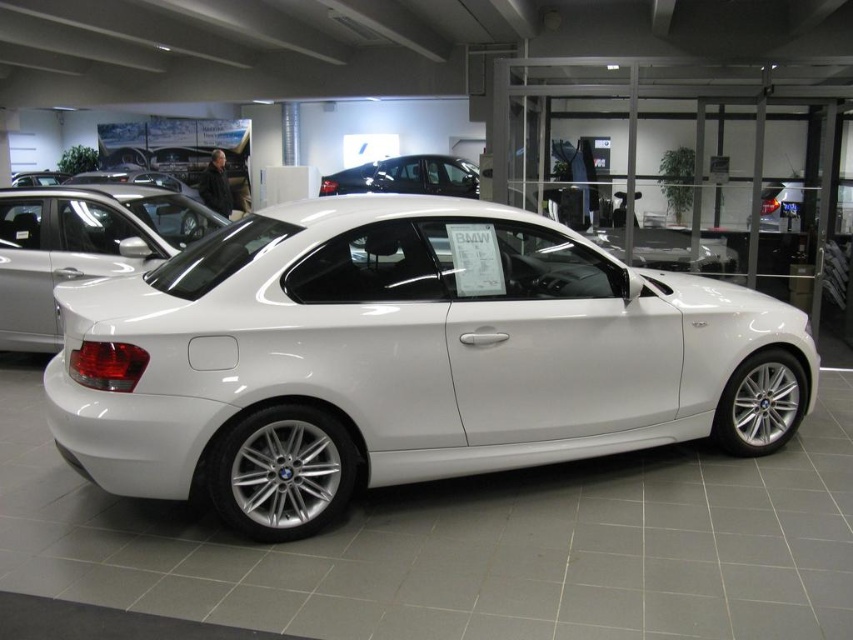
Based on the photo, you are standing at the entrance of the showroom and want to locate the white metallic car at center. According to the coordinates provided, where should you look relative to your position?

The white metallic car at center is located at coordinates point (80, 246), which means it is positioned to the lower right from your perspective when standing at the entrance.

You are a photographer standing in front of the showroom. You want to take a photo of both the white glossy car at center and the white metallic car at center. Which car should you focus on first to ensure both are in sharp focus?

You should focus on the white glossy car at center first because it is closer to the viewer, so adjusting the focus from near to far will help ensure both cars are in sharp focus.